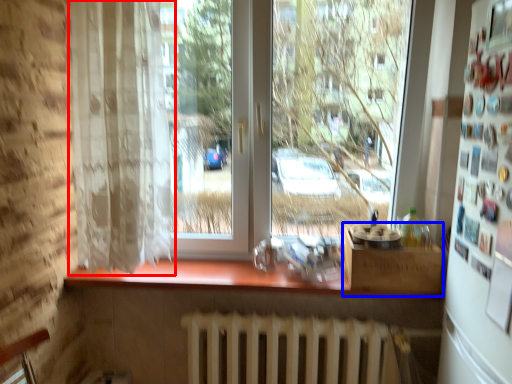
Question: Which of the following is the closest to the observer, curtain (highlighted by a red box) or window box (highlighted by a blue box)?

Choices:
 (A) curtain
 (B) window box

Answer: (A)